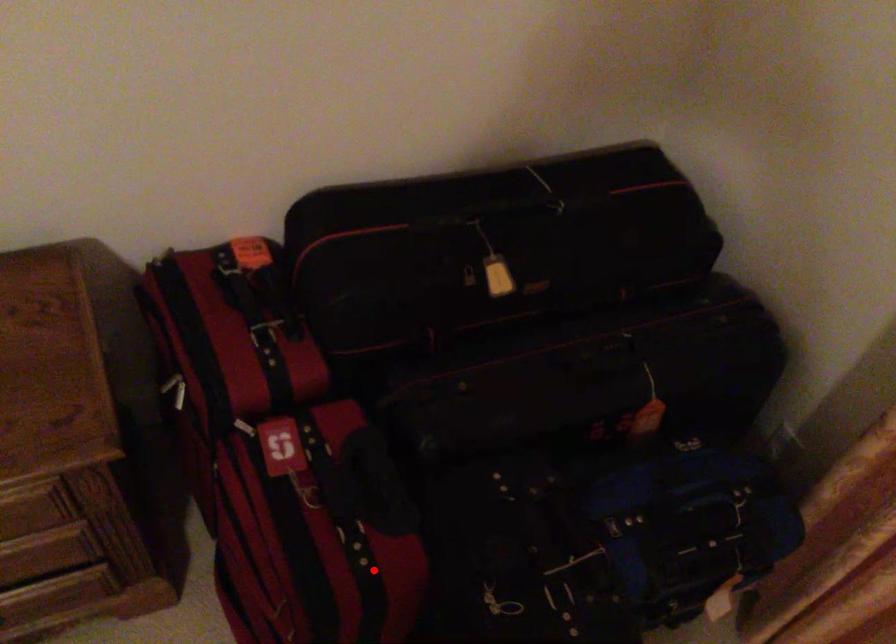
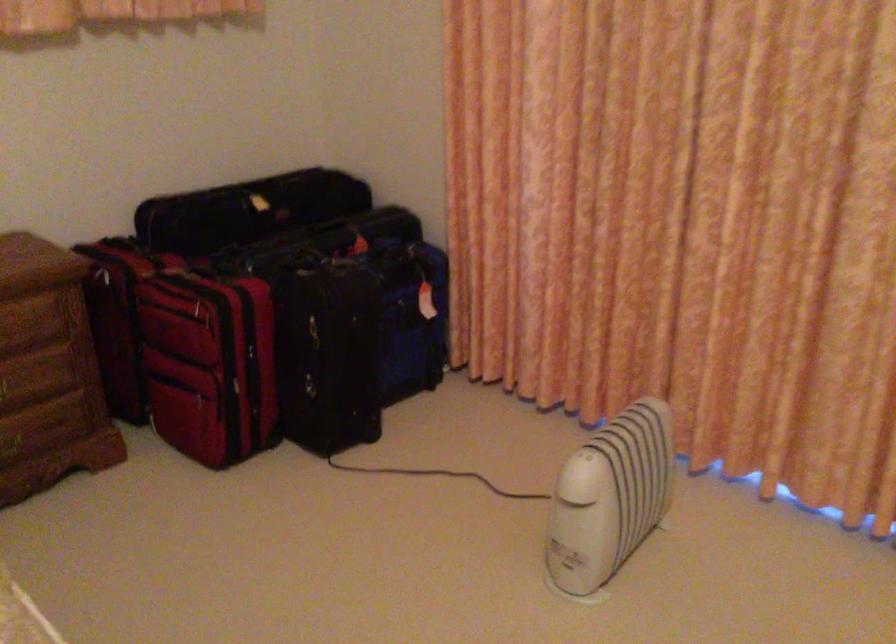
Question: I am providing you with two images of the same scene from different viewpoints. A red point is shown in image1. For the corresponding object point in image2, is it positioned nearer or farther from the camera?

Choices:
 (A) Nearer
 (B) Farther

Answer: (B)